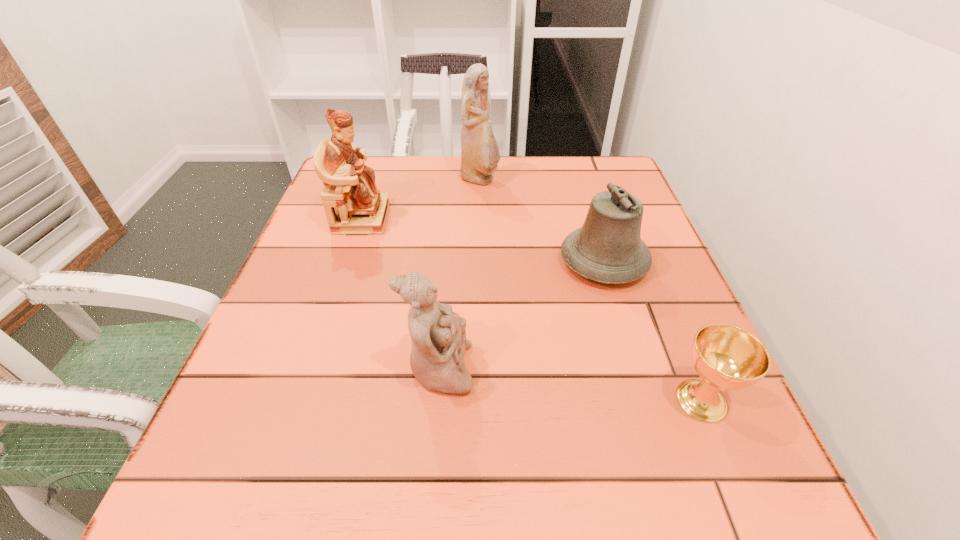
The width and height of the screenshot is (960, 540). I want to click on free location located 0.080m on the front of the bell, so click(623, 324).

The height and width of the screenshot is (540, 960). Find the location of `blank area located on the left of the shortest object`. blank area located on the left of the shortest object is located at coordinates (414, 400).

Find the location of a particular element. This screenshot has height=540, width=960. object situated at the left edge is located at coordinates (349, 185).

You are a GUI agent. You are given a task and a screenshot of the screen. Output one action in this format:
    pyautogui.click(x=<x>, y=<y>)
    Task: Click on the bell that is positioned at the right edge
    This screenshot has height=540, width=960.
    Given the screenshot: What is the action you would take?
    pyautogui.click(x=608, y=248)

This screenshot has width=960, height=540. What are the coordinates of `chalice that is at the right edge` in the screenshot? It's located at (726, 357).

This screenshot has height=540, width=960. Find the location of `object that is at the far left corner`. object that is at the far left corner is located at coordinates (349, 185).

At what (x,y) coordinates should I click in order to perform the action: click on vacant area at the far edge. Please return your answer as a coordinate pair (x, y). The image size is (960, 540). Looking at the image, I should click on (498, 199).

What are the coordinates of `vacant region at the near edge of the desktop` in the screenshot? It's located at (634, 513).

Image resolution: width=960 pixels, height=540 pixels. In order to click on free space at the left edge in this screenshot , I will do `click(235, 377)`.

Locate an element on the screen. The image size is (960, 540). free spot at the far left corner of the desktop is located at coordinates (392, 186).